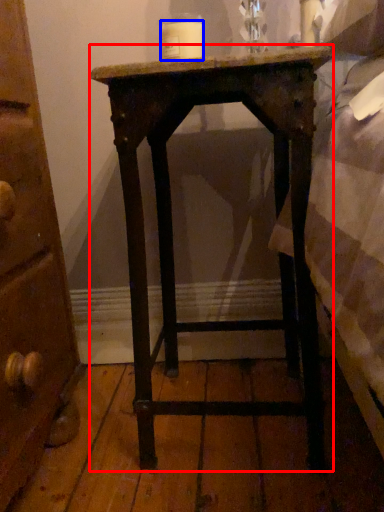
Question: Which of the following is the farthest to the observer, nightstand (highlighted by a red box) or candle (highlighted by a blue box)?

Choices:
 (A) nightstand
 (B) candle

Answer: (B)